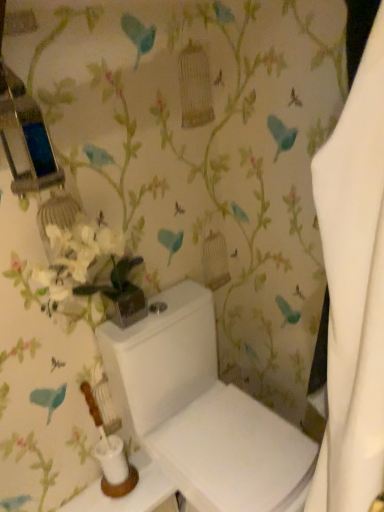
The width and height of the screenshot is (384, 512). What do you see at coordinates (129, 493) in the screenshot?
I see `white glossy toilet tank at lower center` at bounding box center [129, 493].

What is the approximate height of white glossy toilet tank at lower center?

6.39 centimeters.

Find the location of `white glossy toilet tank at lower center`. white glossy toilet tank at lower center is located at coordinates (129, 493).

Measure the distance between white glossy toilet tank at lower center and camera.

The distance of white glossy toilet tank at lower center from camera is 1.37 meters.

The image size is (384, 512). Find the location of `white glossy toilet at center`. white glossy toilet at center is located at coordinates (202, 411).

In order to face white glossy toilet at center, should I rotate leftwards or rightwards?

Turn right by 3.978 degrees to look at white glossy toilet at center.

Measure the distance between point [242,420] and camera.

Point [242,420] and camera are 4.34 feet apart.

From the picture: What is the approximate width of white glossy toilet at center?

white glossy toilet at center is 24.84 inches wide.

Image resolution: width=384 pixels, height=512 pixels. What do you see at coordinates (202, 411) in the screenshot? I see `white glossy toilet at center` at bounding box center [202, 411].

Where is `white glossy toilet tank at lower center`? The width and height of the screenshot is (384, 512). white glossy toilet tank at lower center is located at coordinates (129, 493).

Can you confirm if white glossy toilet at center is positioned to the right of white glossy toilet tank at lower center?

Yes, white glossy toilet at center is to the right of white glossy toilet tank at lower center.

Is white glossy toilet at center positioned before white glossy toilet tank at lower center?

That is True.

Is point (227, 447) positioned behind point (129, 498)?

That is False.

From the image's perspective, is white glossy toilet at center over white glossy toilet tank at lower center?

Indeed, from the image's perspective, white glossy toilet at center is shown above white glossy toilet tank at lower center.

From a real-world perspective, is white glossy toilet at center positioned above or below white glossy toilet tank at lower center?

In terms of real-world spatial position, white glossy toilet at center is above white glossy toilet tank at lower center.

Which of these two, white glossy toilet at center or white glossy toilet tank at lower center, is wider?

white glossy toilet at center.

Based on the photo, considering the sizes of white glossy toilet at center and white glossy toilet tank at lower center in the image, is white glossy toilet at center taller or shorter than white glossy toilet tank at lower center?

Clearly, white glossy toilet at center is taller compared to white glossy toilet tank at lower center.

Considering the sizes of objects white glossy toilet at center and white glossy toilet tank at lower center in the image provided, who is bigger, white glossy toilet at center or white glossy toilet tank at lower center?

white glossy toilet at center.

Do you think white glossy toilet at center is within white glossy toilet tank at lower center, or outside of it?

white glossy toilet at center cannot be found inside white glossy toilet tank at lower center.

Are white glossy toilet at center and white glossy toilet tank at lower center far apart?

white glossy toilet at center is near white glossy toilet tank at lower center, not far away.

Is white glossy toilet at center oriented away from white glossy toilet tank at lower center?

No.

How much distance is there between white glossy toilet at center and white glossy toilet tank at lower center?

white glossy toilet at center is 12.82 inches from white glossy toilet tank at lower center.

At what (x,y) coordinates should I click in order to perform the action: click on table that is below the white glossy toilet at center (from the image's perspective). Please return your answer as a coordinate pair (x, y). The width and height of the screenshot is (384, 512). Looking at the image, I should click on (129, 493).

Between white glossy toilet tank at lower center and white glossy toilet at center, which one appears on the right side from the viewer's perspective?

Positioned to the right is white glossy toilet at center.

Which object is closer to the camera taking this photo, white glossy toilet tank at lower center or white glossy toilet at center?

white glossy toilet at center is more forward.

Considering the points (150, 459) and (167, 306), which point is behind, point (150, 459) or point (167, 306)?

Point (150, 459)

From the image's perspective, between white glossy toilet tank at lower center and white glossy toilet at center, who is located below?

From the image's view, white glossy toilet tank at lower center is below.

From a real-world perspective, between white glossy toilet tank at lower center and white glossy toilet at center, who is vertically lower?

From a 3D spatial view, white glossy toilet tank at lower center is below.

Considering the sizes of white glossy toilet tank at lower center and white glossy toilet at center in the image, is white glossy toilet tank at lower center wider or thinner than white glossy toilet at center?

Considering their sizes, white glossy toilet tank at lower center looks slimmer than white glossy toilet at center.

From their relative heights in the image, would you say white glossy toilet tank at lower center is taller or shorter than white glossy toilet at center?

white glossy toilet tank at lower center is shorter than white glossy toilet at center.

Is white glossy toilet tank at lower center smaller than white glossy toilet at center?

Indeed, white glossy toilet tank at lower center has a smaller size compared to white glossy toilet at center.

Would you say white glossy toilet tank at lower center is inside or outside white glossy toilet at center?

white glossy toilet tank at lower center is not inside white glossy toilet at center, it's outside.

Is white glossy toilet tank at lower center next to white glossy toilet at center?

No, white glossy toilet tank at lower center is not beside white glossy toilet at center.

Is white glossy toilet tank at lower center facing towards white glossy toilet at center?

No, white glossy toilet tank at lower center does not turn towards white glossy toilet at center.

Where is `toilet in front of the white glossy toilet tank at lower center`? The height and width of the screenshot is (512, 384). toilet in front of the white glossy toilet tank at lower center is located at coordinates (202, 411).

This screenshot has height=512, width=384. I want to click on toilet above the white glossy toilet tank at lower center (from the image's perspective), so click(202, 411).

Find the location of a particular element. table that appears below the white glossy toilet at center (from the image's perspective) is located at coordinates (129, 493).